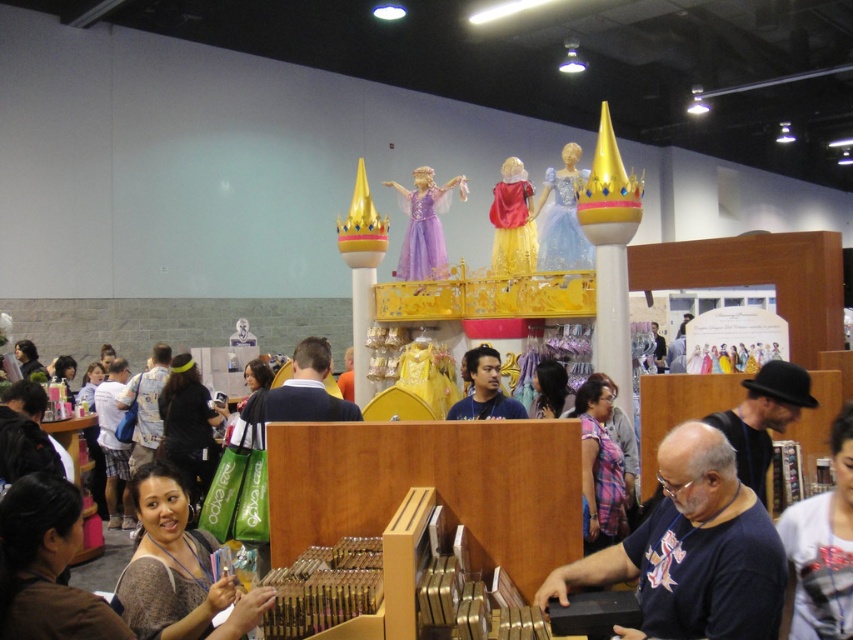
Does point (189, 593) come closer to viewer compared to point (451, 180)?

That is True.

Which is more to the left, matte brown blouse at lower left or matte purple dress at center?

Positioned to the left is matte brown blouse at lower left.

Describe the element at coordinates (178, 570) in the screenshot. I see `matte brown blouse at lower left` at that location.

Where is `matte brown blouse at lower left`? The image size is (853, 640). matte brown blouse at lower left is located at coordinates (178, 570).

Does dark blue t-shirt at lower right have a larger size compared to satin blue dress at upper center?

No.

Between dark blue t-shirt at lower right and satin blue dress at upper center, which one appears on the right side from the viewer's perspective?

satin blue dress at upper center is more to the right.

What do you see at coordinates (692, 550) in the screenshot? The height and width of the screenshot is (640, 853). I see `dark blue t-shirt at lower right` at bounding box center [692, 550].

Locate an element on the screen. The height and width of the screenshot is (640, 853). dark blue t-shirt at lower right is located at coordinates (692, 550).

Can you confirm if matte brown blouse at lower left is wider than matte blue shirt at center?

Correct, the width of matte brown blouse at lower left exceeds that of matte blue shirt at center.

Between matte brown blouse at lower left and matte blue shirt at center, which one is positioned lower?

matte brown blouse at lower left is below.

Where is `matte brown blouse at lower left`? This screenshot has width=853, height=640. matte brown blouse at lower left is located at coordinates (178, 570).